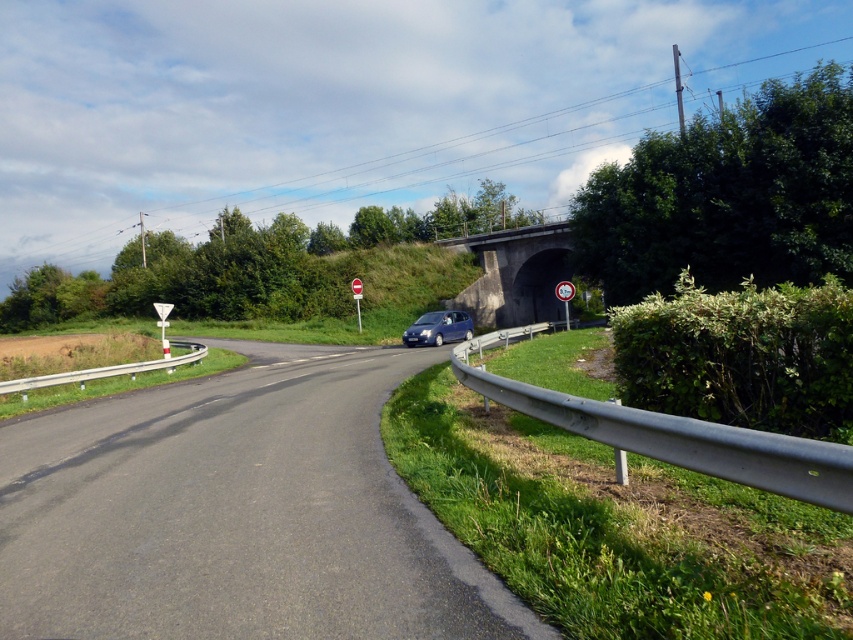
Question: Which object is positioned farthest from the asphalt road at center?

Choices:
 (A) white plastic sign at center
 (B) concrete bridge at center
 (C) red plastic sign at center
 (D) satin blue car at center

Answer: (B)

Question: Does concrete bridge at center appear on the left side of red plastic sign at center?

Choices:
 (A) yes
 (B) no

Answer: (B)

Question: Does concrete bridge at center appear under white plastic sign at center?

Choices:
 (A) yes
 (B) no

Answer: (B)

Question: Which of the following is the farthest from the observer?

Choices:
 (A) (357, 289)
 (B) (409, 342)
 (C) (563, 284)
 (D) (283, 572)

Answer: (A)

Question: Can you confirm if asphalt road at center is positioned below satin blue car at center?

Choices:
 (A) yes
 (B) no

Answer: (A)

Question: Considering the real-world distances, which object is closest to the asphalt road at center?

Choices:
 (A) concrete bridge at center
 (B) satin blue car at center

Answer: (B)